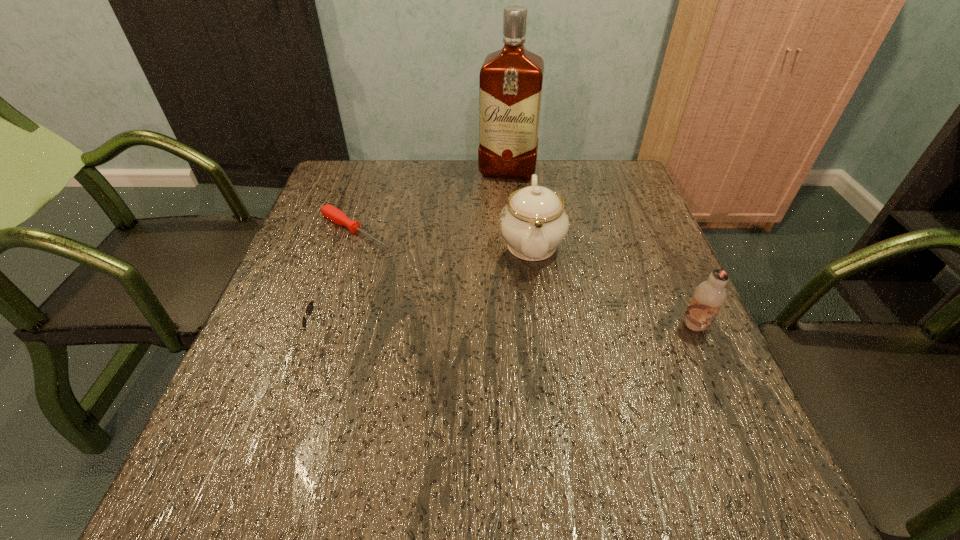
Where is `sunglasses`? The width and height of the screenshot is (960, 540). sunglasses is located at coordinates (309, 308).

This screenshot has height=540, width=960. Identify the location of the rightmost object. (709, 296).

Where is `chinaware`? chinaware is located at coordinates (533, 223).

You are a GUI agent. You are given a task and a screenshot of the screen. Output one action in this format:
    pyautogui.click(x=<x>, y=<y>)
    Task: Click on the shortest object
    Image resolution: width=960 pixels, height=540 pixels.
    Given the screenshot: What is the action you would take?
    pyautogui.click(x=335, y=215)

Where is `the farthest object`? This screenshot has height=540, width=960. the farthest object is located at coordinates (511, 79).

Locate an element on the screen. The image size is (960, 540). the tallest object is located at coordinates (511, 79).

This screenshot has width=960, height=540. In order to click on vacant area situated 0.080m in front of the lenses of the fourth tallest object in this screenshot , I will do `click(272, 335)`.

At what (x,y) coordinates should I click in order to perform the action: click on vacant space located on the back of the rightmost object. Please return your answer as a coordinate pair (x, y). The width and height of the screenshot is (960, 540). Looking at the image, I should click on (683, 298).

This screenshot has height=540, width=960. What are the coordinates of `free space located 0.320m at the spout of the chinaware` in the screenshot? It's located at pyautogui.click(x=540, y=406).

Image resolution: width=960 pixels, height=540 pixels. Find the location of `free space located at the spout of the chinaware`. free space located at the spout of the chinaware is located at coordinates (539, 376).